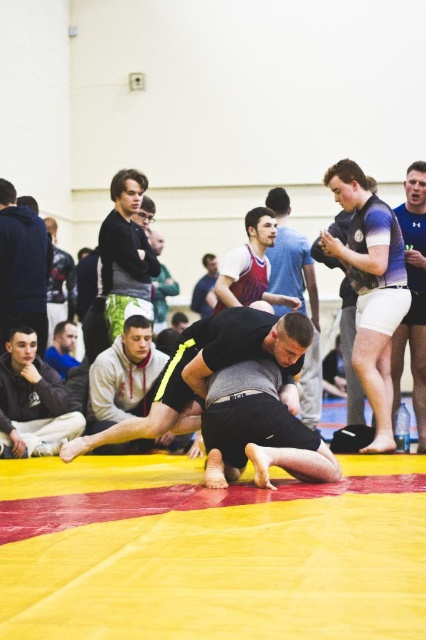
You are a referee observing the wrestling match. You notice two items on the mat near the wrestlers. One is the matte black vest at upper right and the other is the matte red athletic shorts at center. Which item is taller?

The matte black vest at upper right is taller than the matte red athletic shorts at center.

You are a photographer setting up a shot of the wrestling match. You want to focus on the matte black hoodie at center and the matte black wrestling mat at center. Which object will appear larger in your photo?

The matte black wrestling mat at center will appear larger in the photo because it is larger than the matte black hoodie at center.

You are a referee observing the wrestling match. You notice the matte black hoodie at center and the matte black wrestling mat at center. Which object is located to the left?

The matte black hoodie at center is positioned on the left side of the matte black wrestling mat at center.